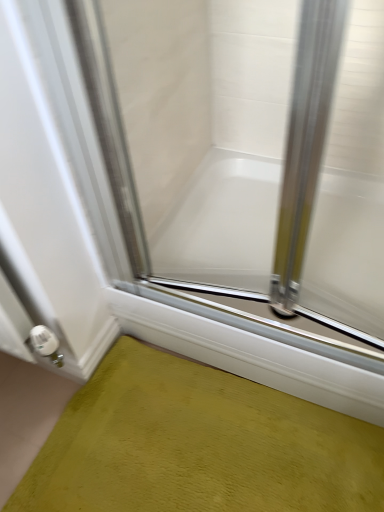
Question: From the image's perspective, relative to white glossy bathtub at center, is green textured bath mat at lower left above or below?

Choices:
 (A) above
 (B) below

Answer: (B)

Question: Considering the relative positions of green textured bath mat at lower left and white glossy bathtub at center in the image provided, is green textured bath mat at lower left to the left or to the right of white glossy bathtub at center?

Choices:
 (A) left
 (B) right

Answer: (A)

Question: Which of these objects is positioned farthest from the green textured bath mat at lower left?

Choices:
 (A) white glossy bathtub at center
 (B) clear glass door at center

Answer: (B)

Question: Considering the real-world distances, which object is closest to the green textured bath mat at lower left?

Choices:
 (A) clear glass door at center
 (B) white glossy bathtub at center

Answer: (B)